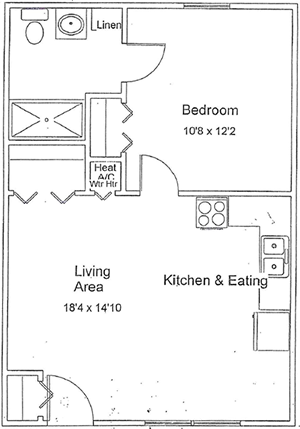
Where is `bathroom`? This screenshot has width=300, height=429. bathroom is located at coordinates (50, 60).